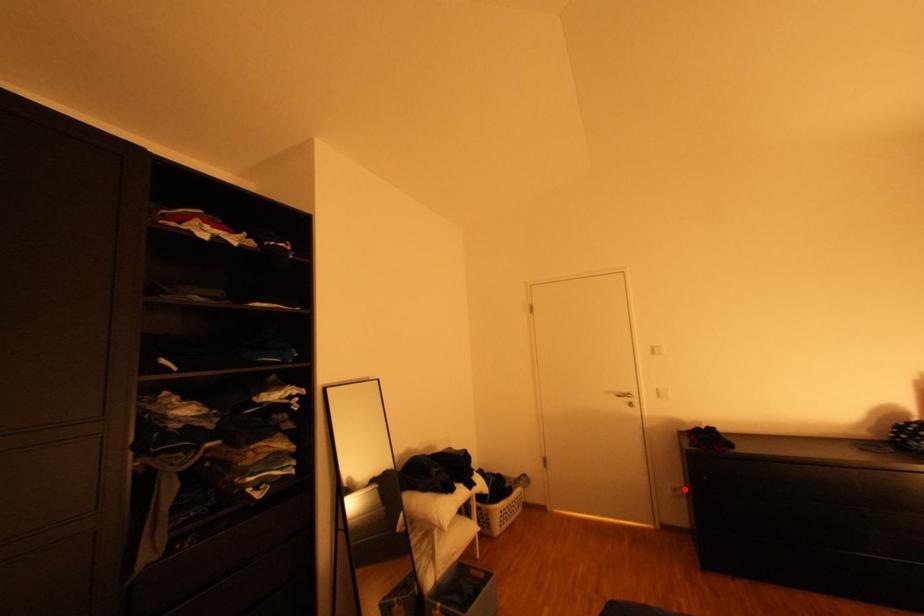
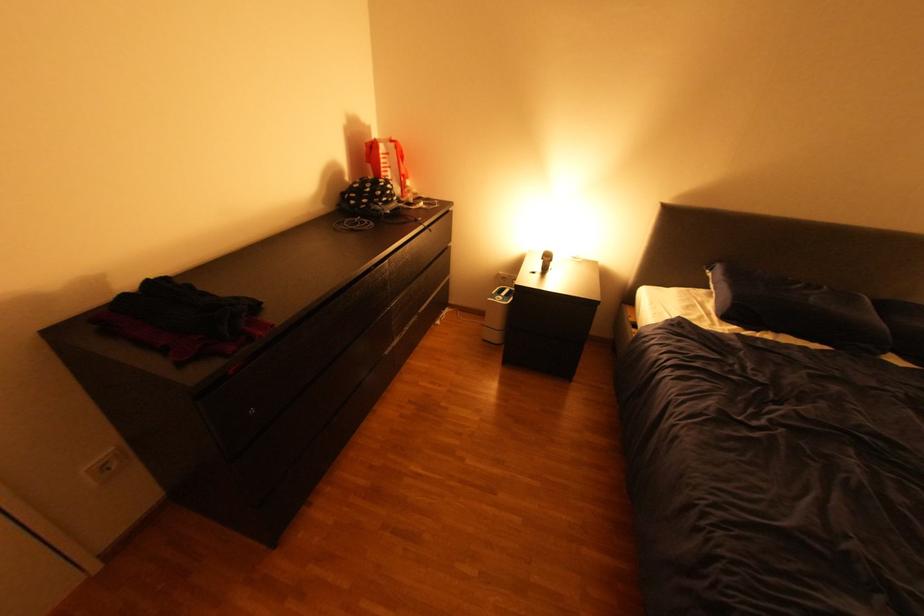
Question: I am providing you with two images of the same scene from different viewpoints. In image1, a red point is highlighted. Considering the same 3D point in image2, which of the following is correct?

Choices:
 (A) It is closer
 (B) It is farther

Answer: (A)